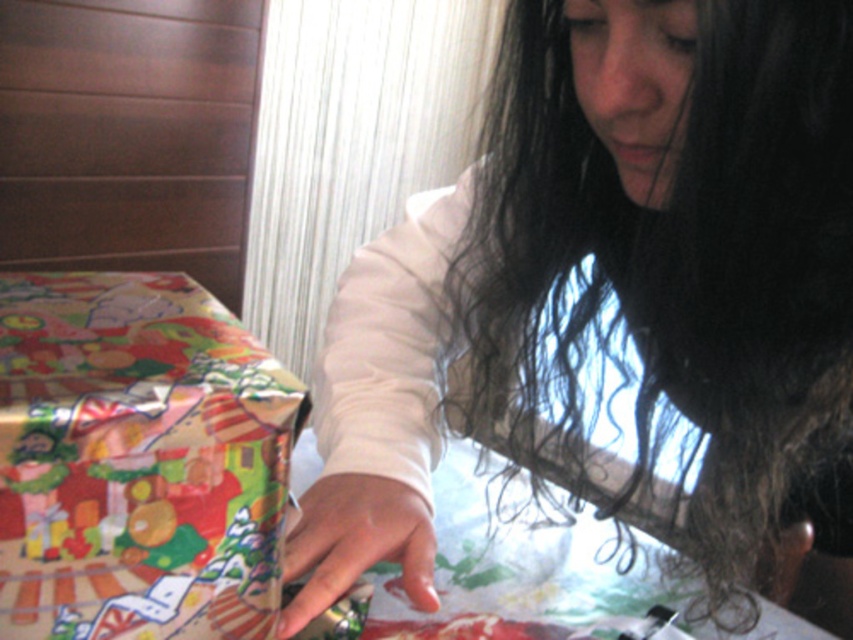
Which is behind, point (595, 493) or point (83, 596)?

The point (595, 493) is behind.

Which of these two, white matte hand at center or shiny metallic gift at lower left, stands shorter?

Standing shorter between the two is shiny metallic gift at lower left.

Does point (782, 97) come closer to viewer compared to point (196, 627)?

No.

Where is `white matte hand at center`? This screenshot has width=853, height=640. white matte hand at center is located at coordinates click(612, 292).